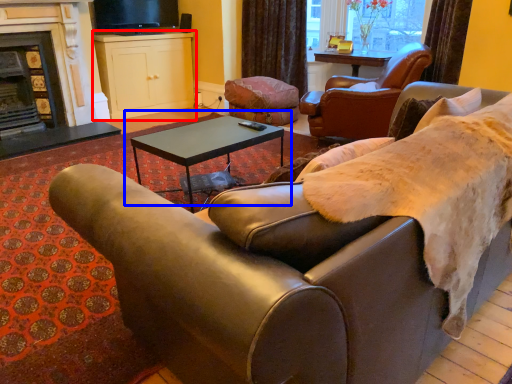
Question: Which point is further to the camera, cabinetry (highlighted by a red box) or coffee table (highlighted by a blue box)?

Choices:
 (A) cabinetry
 (B) coffee table

Answer: (A)